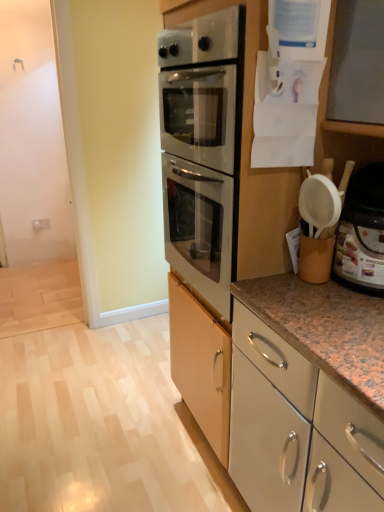
In order to click on white glossy cabinet at lower right, arranged as the 2th cabinetry when viewed from the top in this screenshot , I will do `click(274, 414)`.

Is white plastic container at right surrounded by white glossy cabinet at center, which is counted as the first cabinetry, starting from the top?

That's incorrect, white plastic container at right is not inside white glossy cabinet at center, which is counted as the first cabinetry, starting from the top.

Is white plastic container at right at the back of white glossy cabinet at center, which is counted as the first cabinetry, starting from the top?

No, white glossy cabinet at center, which is counted as the first cabinetry, starting from the top, is not facing away from white plastic container at right.

From a real-world perspective, between white glossy cabinet at center, which is counted as the first cabinetry, starting from the top, and white plastic container at right, who is vertically higher?

white plastic container at right, from a real-world perspective.

Does white plastic container at right touch white glossy cabinet at center, which is counted as the second cabinetry, starting from the bottom?

They are not placed beside each other.

Can we say white plastic container at right lies outside white glossy cabinet at center, which is counted as the first cabinetry, starting from the top?

white plastic container at right lies outside white glossy cabinet at center, which is counted as the first cabinetry, starting from the top,'s area.

Which of these two, white plastic container at right or white glossy cabinet at center, which is counted as the first cabinetry, starting from the top, is thinner?

white plastic container at right.

Between white plastic container at right and white glossy cabinet at center, which is counted as the first cabinetry, starting from the top, which one has more height?

white glossy cabinet at center, which is counted as the first cabinetry, starting from the top, is taller.

Between white plastic container at right and white glossy cabinet at lower right, arranged as the 2th cabinetry when viewed from the top, which one is positioned in front?

white plastic container at right.

Can you tell me how much white plastic container at right and white glossy cabinet at lower right, arranged as the 2th cabinetry when viewed from the top, differ in facing direction?

The facing directions of white plastic container at right and white glossy cabinet at lower right, arranged as the 2th cabinetry when viewed from the top, are 90.3 degrees apart.

From a real-world perspective, relative to white glossy cabinet at lower right, arranged as the 2th cabinetry when viewed from the top, is white plastic container at right vertically above or below?

white plastic container at right is above white glossy cabinet at lower right, arranged as the 2th cabinetry when viewed from the top.

Is white glossy cabinet at lower right, arranged as the 2th cabinetry when viewed from the top, completely or partially inside white plastic container at right?

No, white glossy cabinet at lower right, arranged as the 2th cabinetry when viewed from the top, is not surrounded by white plastic container at right.

From a real-world perspective, is white glossy cabinet at lower right, the 1th cabinetry in the bottom-to-top sequence, located higher than white glossy cabinet at center, which is counted as the first cabinetry, starting from the top?

No, from a real-world perspective, white glossy cabinet at lower right, the 1th cabinetry in the bottom-to-top sequence, is not on top of white glossy cabinet at center, which is counted as the first cabinetry, starting from the top.

From the image's perspective, is white glossy cabinet at lower right, the 1th cabinetry in the bottom-to-top sequence, above or below white glossy cabinet at center, which is counted as the second cabinetry, starting from the bottom?

From the image's perspective, white glossy cabinet at lower right, the 1th cabinetry in the bottom-to-top sequence, appears below white glossy cabinet at center, which is counted as the second cabinetry, starting from the bottom.

Looking at this image, between white glossy cabinet at lower right, the 1th cabinetry in the bottom-to-top sequence, and white glossy cabinet at center, which is counted as the second cabinetry, starting from the bottom, which one appears on the left side from the viewer's perspective?

white glossy cabinet at lower right, the 1th cabinetry in the bottom-to-top sequence.

Which of these two, white glossy cabinet at center, which is counted as the first cabinetry, starting from the top, or white glossy cabinet at lower right, the 1th cabinetry in the bottom-to-top sequence, is bigger?

With larger size is white glossy cabinet at center, which is counted as the first cabinetry, starting from the top.

Is white glossy cabinet at center, which is counted as the second cabinetry, starting from the bottom, taller or shorter than white glossy cabinet at lower right, arranged as the 2th cabinetry when viewed from the top?

In the image, white glossy cabinet at center, which is counted as the second cabinetry, starting from the bottom, appears to be taller than white glossy cabinet at lower right, arranged as the 2th cabinetry when viewed from the top.

What are the coordinates of `cabinetry below the white glossy cabinet at center, which is counted as the second cabinetry, starting from the bottom (from a real-world perspective)` in the screenshot? It's located at (274, 414).

Does white glossy cabinet at lower right, the 1th cabinetry in the bottom-to-top sequence, touch white plastic container at right?

white glossy cabinet at lower right, the 1th cabinetry in the bottom-to-top sequence, and white plastic container at right are clearly separated.

Starting from the white plastic container at right, which cabinetry is the 2nd one to the left? Please provide its 2D coordinates.

[(274, 414)]

Would you say white glossy cabinet at lower right, arranged as the 2th cabinetry when viewed from the top, is outside white plastic container at right?

Absolutely, white glossy cabinet at lower right, arranged as the 2th cabinetry when viewed from the top, is external to white plastic container at right.

What are the coordinates of `cabinetry in front of the white plastic container at right` in the screenshot? It's located at (295, 423).

From the image's perspective, starting from the white plastic container at right, which cabinetry is the 1st one below? Please provide its 2D coordinates.

[(295, 423)]

Considering their positions, is white glossy cabinet at center, which is counted as the second cabinetry, starting from the bottom, positioned further to white plastic container at right than white glossy cabinet at lower right, the 1th cabinetry in the bottom-to-top sequence?

white glossy cabinet at lower right, the 1th cabinetry in the bottom-to-top sequence.

Looking at this image, based on their spatial positions, is white glossy cabinet at lower right, the 1th cabinetry in the bottom-to-top sequence, or white plastic container at right closer to white glossy cabinet at center, which is counted as the first cabinetry, starting from the top?

Among the two, white glossy cabinet at lower right, the 1th cabinetry in the bottom-to-top sequence, is located nearer to white glossy cabinet at center, which is counted as the first cabinetry, starting from the top.

Based on their spatial positions, is white plastic container at right or white glossy cabinet at lower right, arranged as the 2th cabinetry when viewed from the top, closer to white glossy cabinet at center, which is counted as the second cabinetry, starting from the bottom?

The object closer to white glossy cabinet at center, which is counted as the second cabinetry, starting from the bottom, is white glossy cabinet at lower right, arranged as the 2th cabinetry when viewed from the top.

Looking at the image, which one is located further to white plastic container at right, white glossy cabinet at lower right, arranged as the 2th cabinetry when viewed from the top, or white glossy cabinet at center, which is counted as the second cabinetry, starting from the bottom?

white glossy cabinet at lower right, arranged as the 2th cabinetry when viewed from the top, is further to white plastic container at right.

Which object lies further to the anchor point white glossy cabinet at lower right, the 1th cabinetry in the bottom-to-top sequence, white glossy cabinet at center, which is counted as the first cabinetry, starting from the top, or white plastic container at right?

white plastic container at right is further to white glossy cabinet at lower right, the 1th cabinetry in the bottom-to-top sequence.

Which object lies nearer to the anchor point white glossy cabinet at lower right, arranged as the 2th cabinetry when viewed from the top, white plastic container at right or white glossy cabinet at center, which is counted as the first cabinetry, starting from the top?

white glossy cabinet at center, which is counted as the first cabinetry, starting from the top, lies closer to white glossy cabinet at lower right, arranged as the 2th cabinetry when viewed from the top, than the other object.

Identify the location of cabinetry between white plastic container at right and white glossy cabinet at lower right, arranged as the 2th cabinetry when viewed from the top, in the vertical direction. (295, 423).